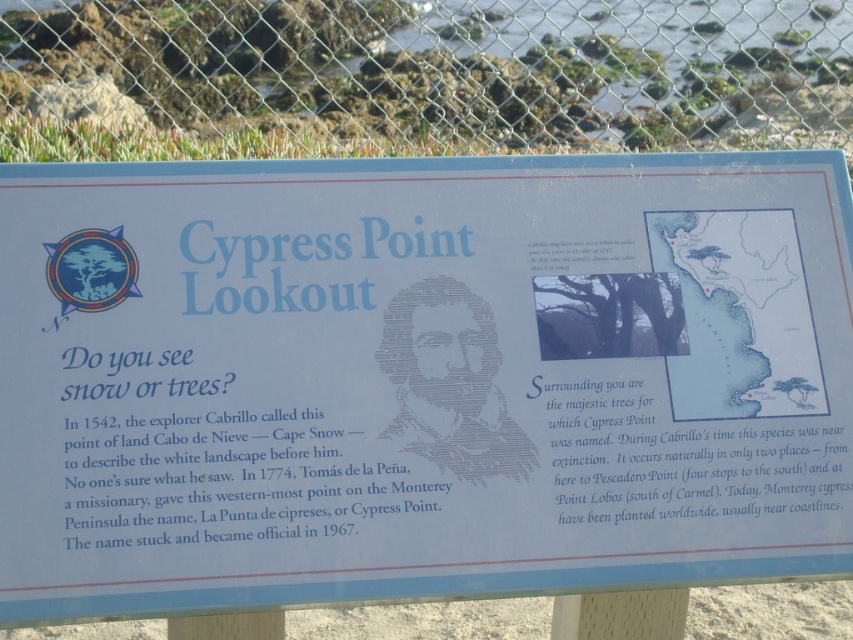
Is white plastic sign at center shorter than green chain-link fence at upper center?

Yes.

Which is more to the left, white plastic sign at center or green chain-link fence at upper center?

From the viewer's perspective, green chain-link fence at upper center appears more on the left side.

I want to click on white plastic sign at center, so click(x=416, y=378).